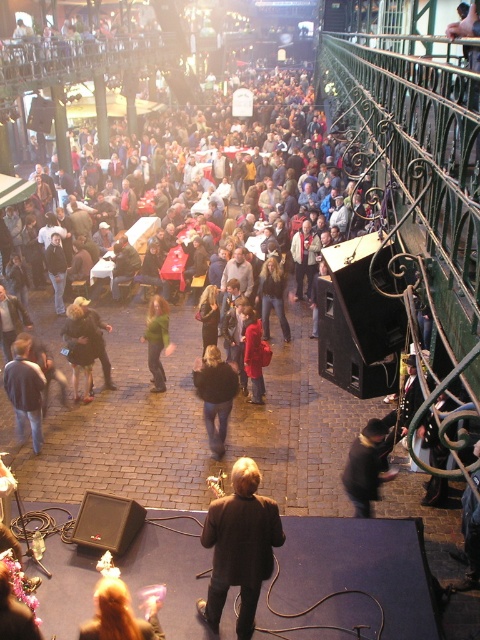
Which of these two, black matte coat at center or black fuzzy coat at center, stands shorter?

black fuzzy coat at center is shorter.

Is point (249, 595) closer to camera compared to point (208, 428)?

Yes, it is in front of point (208, 428).

Who is more distant from viewer, (217, 630) or (222, 406)?

The point (222, 406) is more distant.

At what (x,y) coordinates should I click in order to perform the action: click on black matte coat at center. Please return your answer as a coordinate pair (x, y). The height and width of the screenshot is (640, 480). Looking at the image, I should click on (240, 547).

Does green fabric jacket at center have a greater height compared to green fuzzy jacket at center?

Yes.

Does green fabric jacket at center have a greater width compared to green fuzzy jacket at center?

Yes.

Identify the location of green fabric jacket at center. pos(79,349).

Image resolution: width=480 pixels, height=640 pixels. What do you see at coordinates (120, 614) in the screenshot?
I see `blonde hair at lower left` at bounding box center [120, 614].

Between blonde hair at lower left and green fuzzy jacket at center, which one is positioned lower?

blonde hair at lower left is lower down.

Does point (120, 588) lie in front of point (156, 387)?

Yes.

The height and width of the screenshot is (640, 480). Identify the location of blonde hair at lower left. (120, 614).